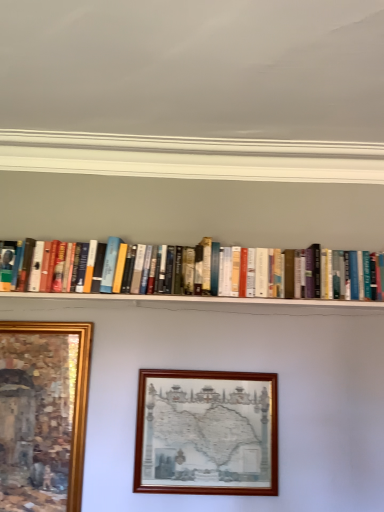
Question: Is hardcover books at center placed right next to gold-framed painting at lower left, the 2th picture frame viewed from the right?

Choices:
 (A) yes
 (B) no

Answer: (B)

Question: Is hardcover books at center not close to gold-framed painting at lower left, the 2th picture frame viewed from the right?

Choices:
 (A) no
 (B) yes

Answer: (A)

Question: Can you confirm if hardcover books at center is positioned to the right of gold-framed painting at lower left, the 2th picture frame viewed from the right?

Choices:
 (A) no
 (B) yes

Answer: (B)

Question: Is the position of hardcover books at center less distant than that of gold-framed painting at lower left, the 2th picture frame viewed from the right?

Choices:
 (A) no
 (B) yes

Answer: (A)

Question: Is hardcover books at center wider than gold-framed painting at lower left, which is the 1th picture frame in left-to-right order?

Choices:
 (A) yes
 (B) no

Answer: (A)

Question: From the image's perspective, is hardcover books at center positioned above or below gold-framed painting at lower left, the 2th picture frame viewed from the right?

Choices:
 (A) above
 (B) below

Answer: (A)

Question: Is hardcover books at center taller or shorter than gold-framed painting at lower left, which is the 1th picture frame in left-to-right order?

Choices:
 (A) tall
 (B) short

Answer: (B)

Question: Is point (188, 251) positioned closer to the camera than point (3, 342)?

Choices:
 (A) farther
 (B) closer

Answer: (B)

Question: In terms of width, does hardcover books at center look wider or thinner when compared to gold-framed painting at lower left, the 2th picture frame viewed from the right?

Choices:
 (A) wide
 (B) thin

Answer: (A)

Question: From a real-world perspective, is hardcover books at center positioned above or below wooden picture frame at center, which is the second picture frame in left-to-right order?

Choices:
 (A) below
 (B) above

Answer: (B)

Question: Is hardcover books at center taller or shorter than wooden picture frame at center, placed as the 1th picture frame when sorted from right to left?

Choices:
 (A) short
 (B) tall

Answer: (A)

Question: Is hardcover books at center inside the boundaries of wooden picture frame at center, which is the second picture frame in left-to-right order, or outside?

Choices:
 (A) inside
 (B) outside

Answer: (B)

Question: Based on their positions, is hardcover books at center located to the left or right of wooden picture frame at center, which is the second picture frame in left-to-right order?

Choices:
 (A) right
 (B) left

Answer: (B)

Question: Considering the positions of point (21, 480) and point (357, 270), is point (21, 480) closer or farther from the camera than point (357, 270)?

Choices:
 (A) closer
 (B) farther

Answer: (A)

Question: Is gold-framed painting at lower left, the 2th picture frame viewed from the right, spatially inside hardcover books at center, or outside of it?

Choices:
 (A) outside
 (B) inside

Answer: (A)